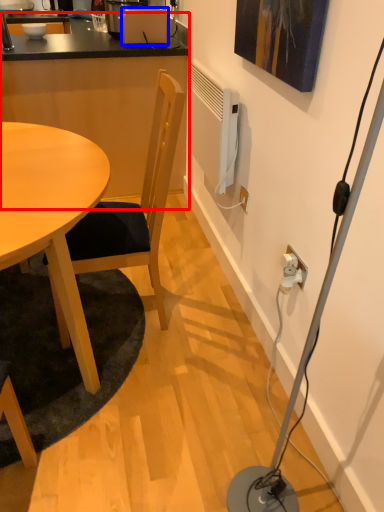
Question: Which object is further to the camera taking this photo, computer desk (highlighted by a red box) or toaster (highlighted by a blue box)?

Choices:
 (A) computer desk
 (B) toaster

Answer: (B)